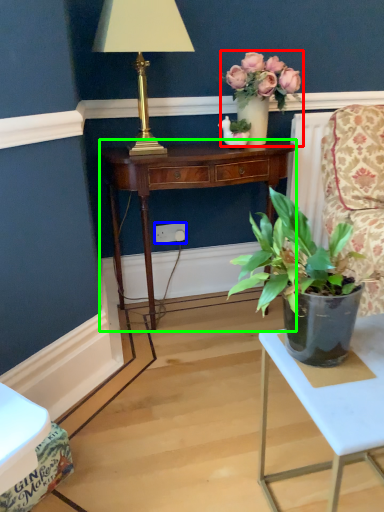
Question: Estimate the real-world distances between objects in this image. Which object is farther from houseplant (highlighted by a red box), power outlet (highlighted by a blue box) or desk (highlighted by a green box)?

Choices:
 (A) power outlet
 (B) desk

Answer: (A)